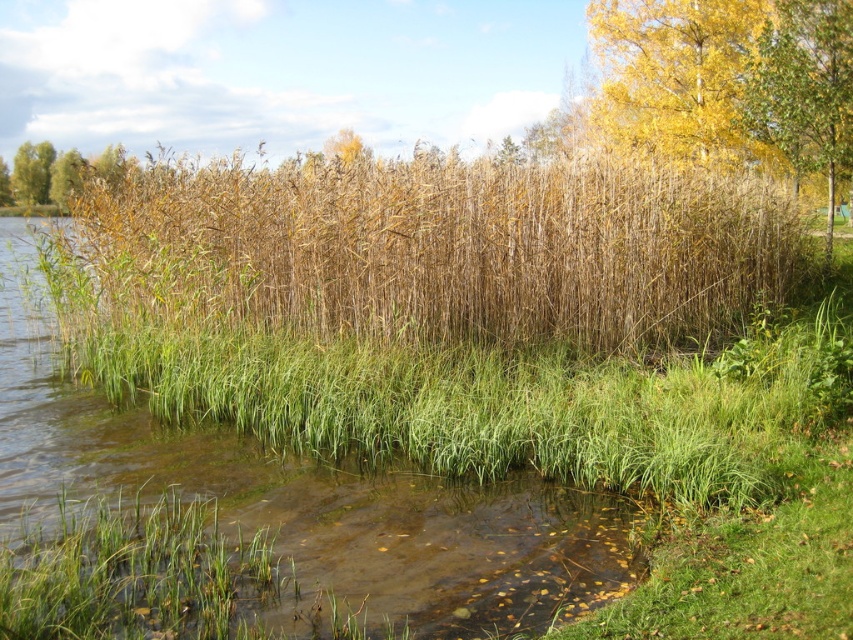
Question: Which of the following is the closest to the observer?

Choices:
 (A) green leafy tree at upper right
 (B) green grass at left

Answer: (A)

Question: Where is dry grass at center located in relation to green leafy tree at upper right in the image?

Choices:
 (A) left
 (B) right

Answer: (A)

Question: Which point is closer to the camera?

Choices:
 (A) green grass at left
 (B) yellow leafy tree at upper right
 (C) dry grass at center

Answer: (C)

Question: Which point appears closest to the camera in this image?

Choices:
 (A) (x=834, y=147)
 (B) (x=654, y=259)
 (C) (x=19, y=193)

Answer: (B)

Question: Is yellow leafy tree at upper right thinner than green leafy tree at upper right?

Choices:
 (A) yes
 (B) no

Answer: (B)

Question: Does dry grass at center have a larger size compared to yellow leafy tree at upper right?

Choices:
 (A) yes
 (B) no

Answer: (A)